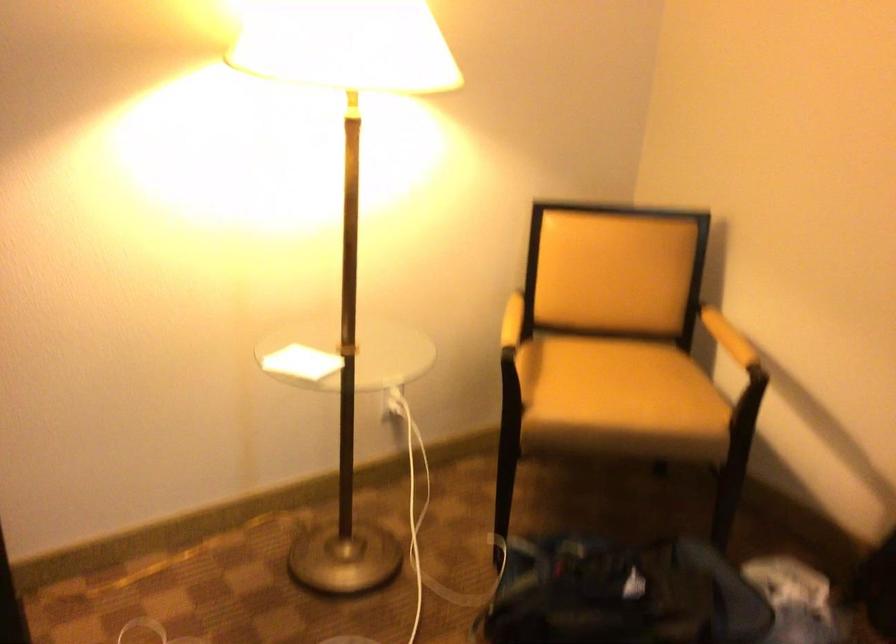
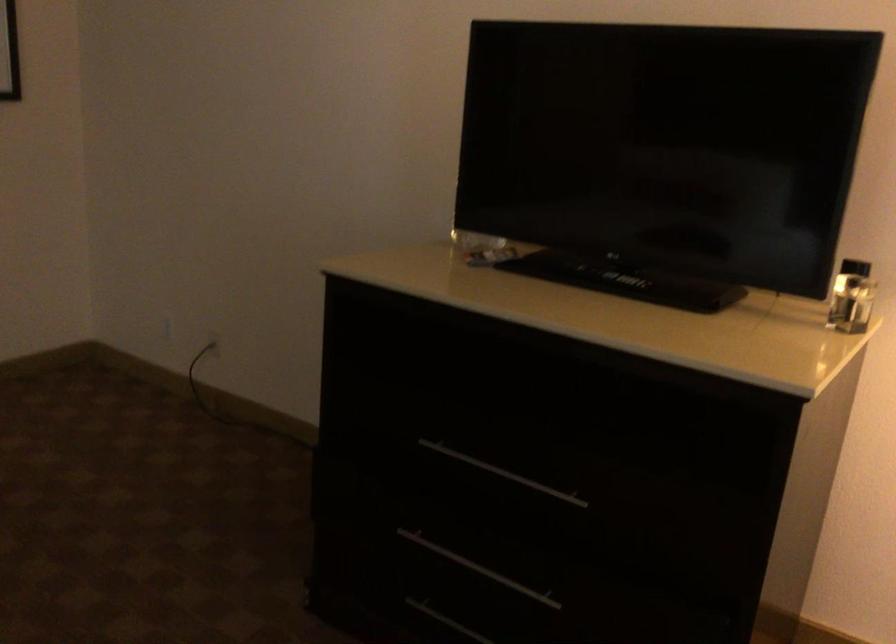
Question: The camera is either moving clockwise (left) or counter-clockwise (right) around the object. The first image is from the beginning of the video and the second image is from the end. Is the camera moving left or right when shooting the video?

Choices:
 (A) Left
 (B) Right

Answer: (B)